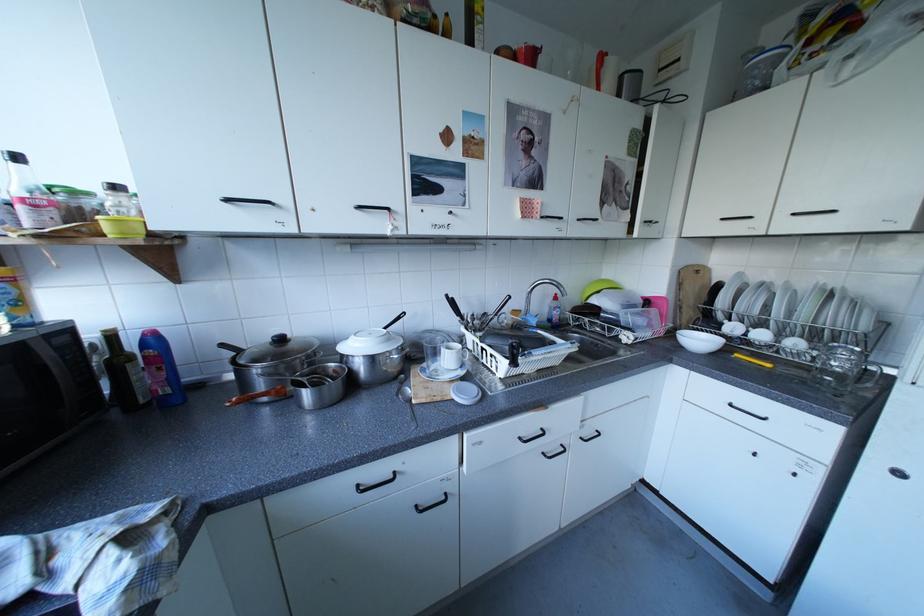
This screenshot has width=924, height=616. Find the location of `red bottle cap`. red bottle cap is located at coordinates (554, 296).